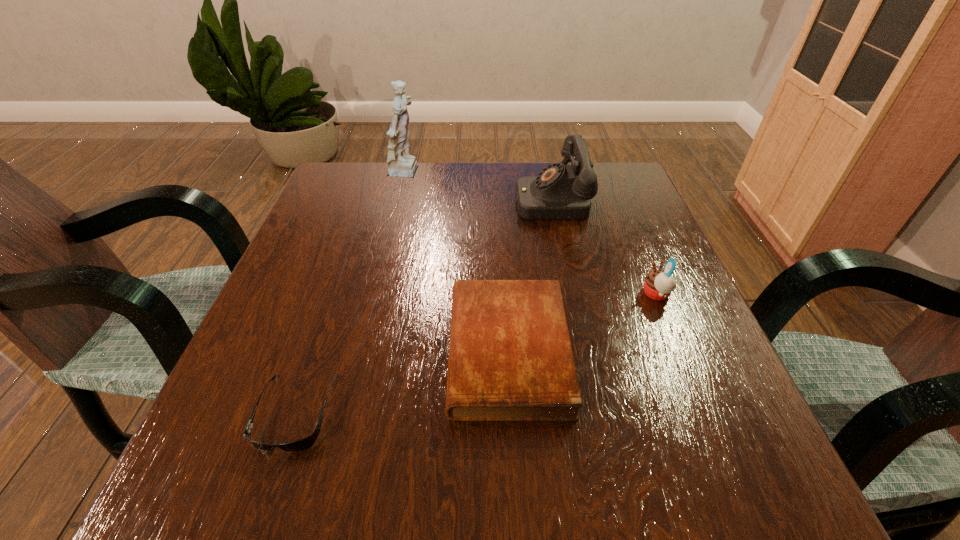
In order to click on vacant space located 0.250m on the front-facing side of the muffin in this screenshot , I will do `click(509, 294)`.

At what (x,y) coordinates should I click in order to perform the action: click on free space located 0.390m on the front-facing side of the muffin. Please return your answer as a coordinate pair (x, y). This screenshot has height=540, width=960. Looking at the image, I should click on (434, 294).

In order to click on free location located 0.320m on the front-facing side of the muffin in this screenshot , I will do `click(471, 294)`.

The image size is (960, 540). What are the coordinates of `free space located on the spine side of the Bible` in the screenshot? It's located at click(251, 351).

Identify the location of free spot located on the spine side of the Bible. This screenshot has height=540, width=960. (275, 351).

Where is `vacant space located 0.310m on the spine side of the Bible`? This screenshot has width=960, height=540. vacant space located 0.310m on the spine side of the Bible is located at coordinates tap(262, 351).

The image size is (960, 540). I want to click on figurine that is at the far edge, so click(x=401, y=164).

The image size is (960, 540). In order to click on telephone positioned at the far edge in this screenshot , I will do 560,192.

I want to click on object located in the near edge section of the desktop, so click(305, 443).

Locate an element on the screen. This screenshot has height=540, width=960. figurine positioned at the left edge is located at coordinates (401, 164).